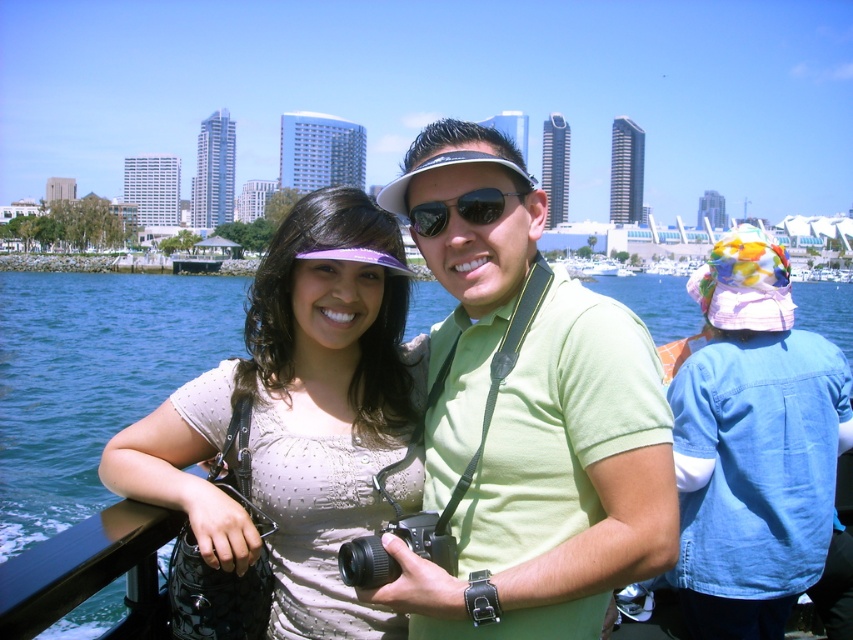
Question: Is green matte shirt at center bigger than matte beige blouse at center?

Choices:
 (A) no
 (B) yes

Answer: (B)

Question: Which object appears closest to the camera in this image?

Choices:
 (A) sunglasses at center
 (B) black plastic camera at center

Answer: (B)

Question: Does matte beige blouse at center appear under sunglasses at center?

Choices:
 (A) yes
 (B) no

Answer: (A)

Question: Can you confirm if matte beige blouse at center is bigger than blue water at lower left?

Choices:
 (A) yes
 (B) no

Answer: (B)

Question: Based on their relative distances, which object is farther from the sunglasses at center?

Choices:
 (A) matte beige blouse at center
 (B) green matte shirt at center
 (C) black plastic camera at center
 (D) blue water at lower left

Answer: (D)

Question: Which object is positioned closest to the blue water at lower left?

Choices:
 (A) black plastic camera at center
 (B) sunglasses at center
 (C) green matte shirt at center
 (D) matte beige blouse at center

Answer: (D)